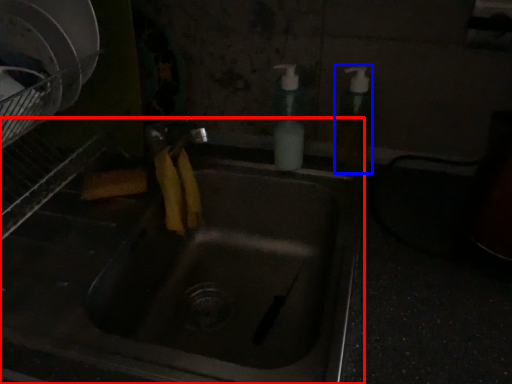
Question: Which point is further to the camera, sink (highlighted by a red box) or soap dispenser (highlighted by a blue box)?

Choices:
 (A) sink
 (B) soap dispenser

Answer: (B)